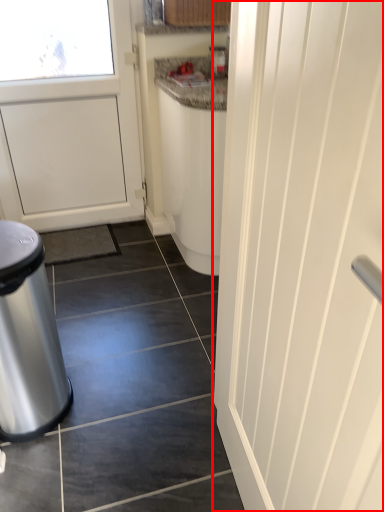
Question: Where is door (annotated by the red box) located in relation to waste container in the image?

Choices:
 (A) left
 (B) right

Answer: (B)